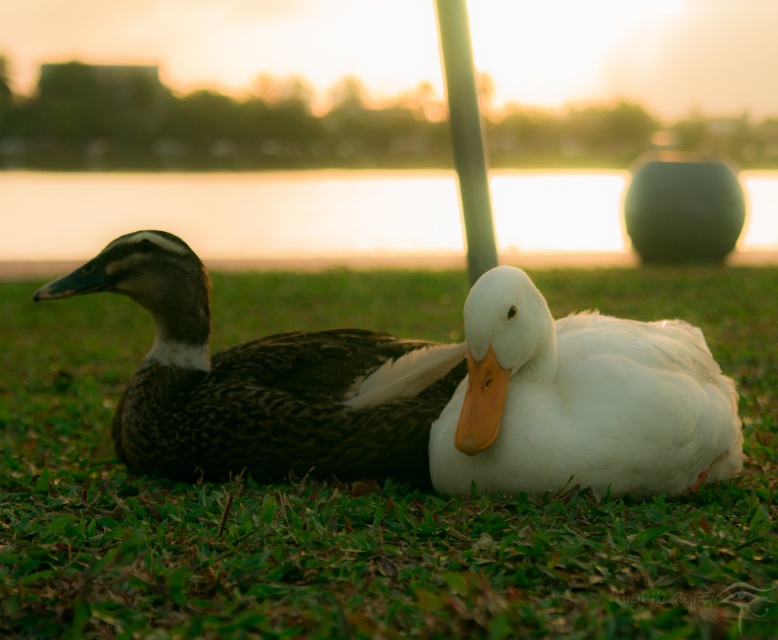
You are a photographer setting up a tripod to capture the ducks in the scene. You want to focus on the duck at point (587, 568) and the duck at point (454, 166). Based on their positions, which duck will appear larger in the photo?

The duck at point (587, 568) will appear larger in the photo because it is closer to the viewer than the duck at point (454, 166).

You are a birdwatcher trying to identify the ducks in the image. You see the dark brown feathers at center and the white glossy pole at center. Which one is smaller?

The dark brown feathers at center is smaller than the white glossy pole at center.